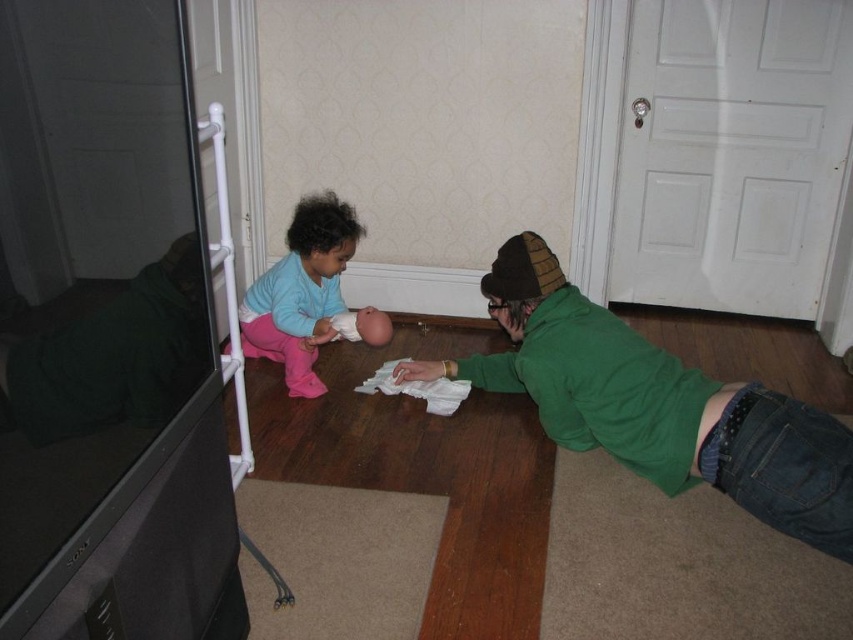
Based on the photo, you are organizing a charity event and need to display two sweaters from the image. The display area has a shelf that can only accommodate items up to the width of the matte blue sweater at center. Can the green soft sweater at lower right fit on the same shelf without overlapping?

The green soft sweater at lower right might be wider than the matte blue sweater at center, so it may not fit on the shelf designed for the width of the matte blue sweater at center. Check the actual size before placing it.

You are standing at the entrance of the room and want to move towards the point marked as point (836, 481). However, there is an obstacle at point (309, 278). Will you encounter the obstacle before reaching your destination?

Since point (836, 481) is in front of point (309, 278), you will reach the destination before encountering the obstacle at point (309, 278).